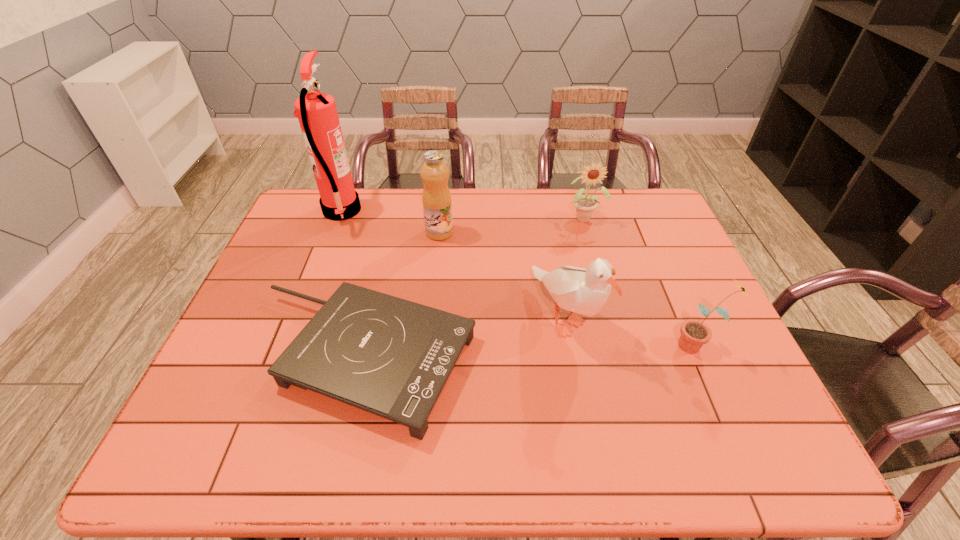
The image size is (960, 540). What are the coordinates of `free spot between the gull and the tallest object` in the screenshot? It's located at 453,264.

Where is `vacant region between the hotplate and the farther sunflower`? vacant region between the hotplate and the farther sunflower is located at coordinates 473,288.

This screenshot has width=960, height=540. Find the location of `unoccupied area between the fruit juice and the gull`. unoccupied area between the fruit juice and the gull is located at coordinates (502, 275).

This screenshot has height=540, width=960. Identify the location of vacant area between the shortest object and the farther sunflower. (473, 288).

This screenshot has width=960, height=540. Find the location of `free space between the rightmost object and the gull`. free space between the rightmost object and the gull is located at coordinates (631, 331).

Image resolution: width=960 pixels, height=540 pixels. Identify the location of free space between the right sunflower and the gull. (631, 331).

At what (x,y) coordinates should I click in order to perform the action: click on vacant space that is in between the rightmost object and the gull. Please return your answer as a coordinate pair (x, y). Looking at the image, I should click on (631, 331).

You are a GUI agent. You are given a task and a screenshot of the screen. Output one action in this format:
    pyautogui.click(x=<x>, y=<y>)
    Task: Click on the free space that is in between the fire extinguisher and the fruit juice
    
    Given the screenshot: What is the action you would take?
    pyautogui.click(x=391, y=222)

Identify the location of object that is the fourth closest one to the gull. The width and height of the screenshot is (960, 540). (437, 206).

Identify the location of object that ranks as the fourth closest to the gull. This screenshot has height=540, width=960. (437, 206).